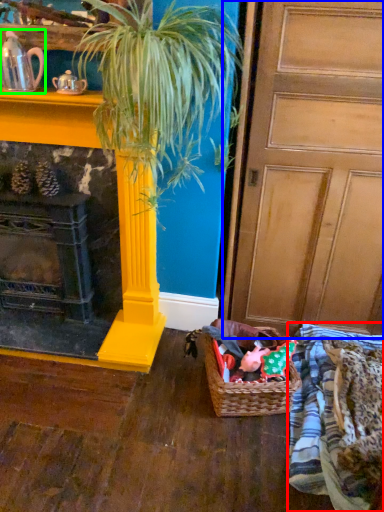
Question: Which object is the farthest from clothing (highlighted by a red box)? Choose among these: door (highlighted by a blue box) or tea pot (highlighted by a green box).

Choices:
 (A) door
 (B) tea pot

Answer: (B)